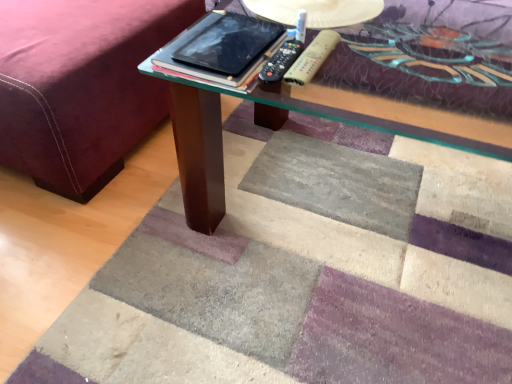
Find the location of a particular element. The width and height of the screenshot is (512, 384). free area below black glossy tablet at center (from a real-world perspective) is located at coordinates (226, 45).